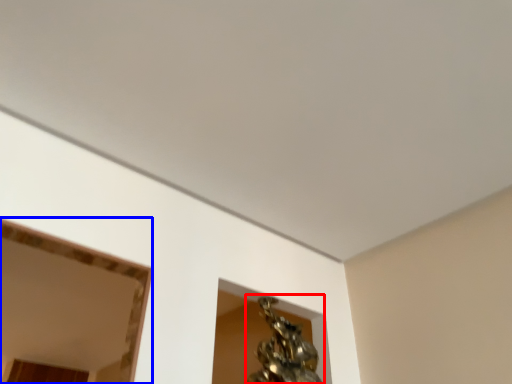
Question: Which of the following is the farthest to the observer, bronze sculpture (highlighted by a red box) or mirror (highlighted by a blue box)?

Choices:
 (A) bronze sculpture
 (B) mirror

Answer: (B)